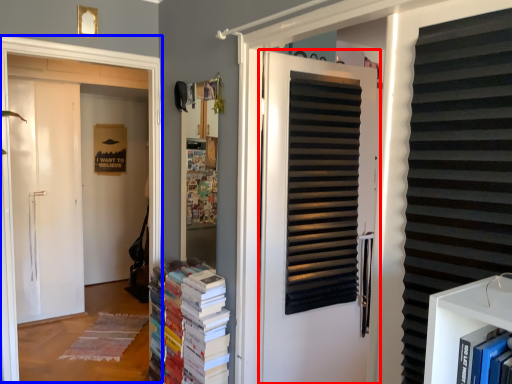
Question: Among these objects, which one is nearest to the camera, door (highlighted by a red box) or window frame (highlighted by a blue box)?

Choices:
 (A) door
 (B) window frame

Answer: (A)